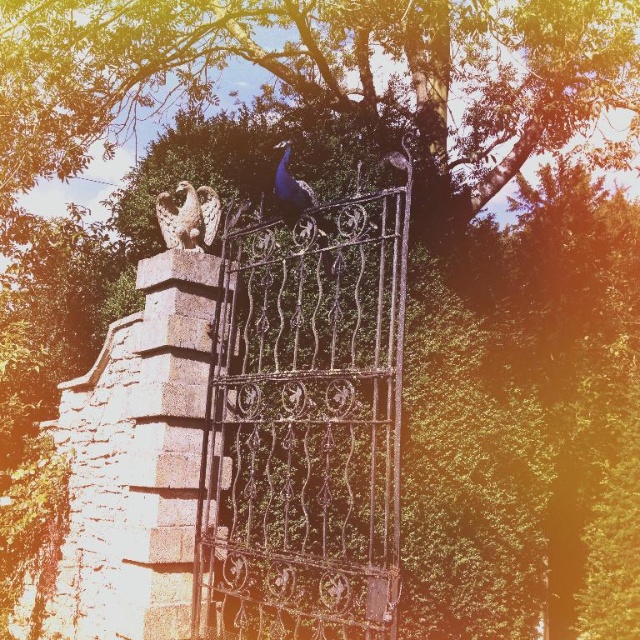
In the scene shown: You are designing a garden layout and need to place a new statue that is 1.5 meters tall. The wrought iron gate at center and the stone eagle at upper center are already present. Considering their sizes, which existing object can the new statue be placed next to without blocking the view of the smaller one?

The wrought iron gate at center is larger in size than the stone eagle at upper center, so the new statue can be placed next to the stone eagle at upper center without blocking its view, as the statue is the same height as the smaller object.

You are an artist planning to paint this scene. You want to ensure the stone eagle at upper center and the shiny blue peacock at center are proportionally accurate. Which one should you draw smaller in your painting?

The stone eagle at upper center should be drawn smaller than the shiny blue peacock at center because the stone eagle at upper center has a smaller size compared to shiny blue peacock at center.